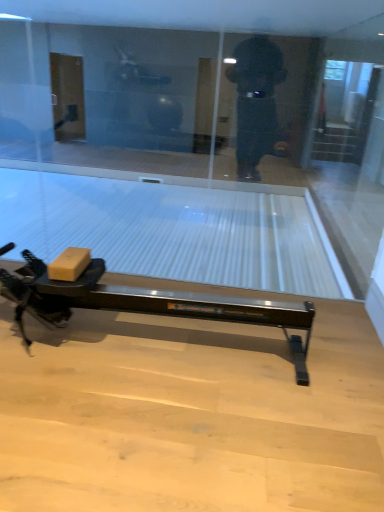
Question: Is transparent glass at center looking in the opposite direction of matte cardboard box at lower left?

Choices:
 (A) yes
 (B) no

Answer: (A)

Question: Considering the relative positions of transparent glass at center and matte cardboard box at lower left in the image provided, is transparent glass at center to the right of matte cardboard box at lower left from the viewer's perspective?

Choices:
 (A) yes
 (B) no

Answer: (A)

Question: From a real-world perspective, is transparent glass at center located higher than matte cardboard box at lower left?

Choices:
 (A) yes
 (B) no

Answer: (A)

Question: Can you confirm if transparent glass at center is thinner than matte cardboard box at lower left?

Choices:
 (A) no
 (B) yes

Answer: (B)

Question: Is transparent glass at center surrounding matte cardboard box at lower left?

Choices:
 (A) yes
 (B) no

Answer: (B)

Question: Based on their positions, is transparent glass screen door at upper right located to the left or right of transparent glass at center?

Choices:
 (A) left
 (B) right

Answer: (B)

Question: From their relative heights in the image, would you say transparent glass screen door at upper right is taller or shorter than transparent glass at center?

Choices:
 (A) tall
 (B) short

Answer: (A)

Question: Considering the positions of point (354, 150) and point (28, 225), is point (354, 150) closer or farther from the camera than point (28, 225)?

Choices:
 (A) farther
 (B) closer

Answer: (A)

Question: In terms of width, does transparent glass screen door at upper right look wider or thinner when compared to transparent glass at center?

Choices:
 (A) wide
 (B) thin

Answer: (A)

Question: Considering the relative positions of transparent glass at center and matte cardboard box at lower left in the image provided, is transparent glass at center to the left or to the right of matte cardboard box at lower left?

Choices:
 (A) right
 (B) left

Answer: (A)

Question: Considering the positions of transparent glass at center and matte cardboard box at lower left in the image, is transparent glass at center wider or thinner than matte cardboard box at lower left?

Choices:
 (A) wide
 (B) thin

Answer: (B)

Question: Which is correct: transparent glass at center is inside matte cardboard box at lower left, or outside of it?

Choices:
 (A) inside
 (B) outside

Answer: (B)

Question: Is transparent glass at center taller or shorter than matte cardboard box at lower left?

Choices:
 (A) tall
 (B) short

Answer: (A)

Question: In the image, is transparent glass screen door at upper right positioned in front of or behind matte cardboard box at lower left?

Choices:
 (A) front
 (B) behind

Answer: (B)

Question: Does point (340, 139) appear closer or farther from the camera than point (82, 262)?

Choices:
 (A) closer
 (B) farther

Answer: (B)